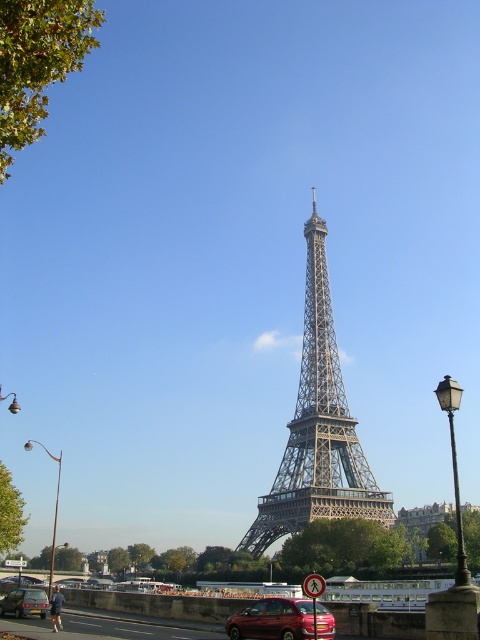
Who is lower down, metallic structure at center or metallic silver car at lower left?

metallic silver car at lower left

Is point (267, 500) less distant than point (17, 609)?

That is True.

You are a GUI agent. You are given a task and a screenshot of the screen. Output one action in this format:
    pyautogui.click(x=<x>, y=<y>)
    Task: Click on the metallic structure at center
    Image resolution: width=480 pixels, height=640 pixels.
    Given the screenshot: What is the action you would take?
    pyautogui.click(x=317, y=428)

Looking at this image, does metallic red car at center come behind metallic silver car at lower left?

No, it is not.

Between point (275, 605) and point (15, 604), which one is positioned in front?

Point (275, 605) is more forward.

Does point (228, 636) come behind point (27, 595)?

No, it is in front of (27, 595).

Find the location of a particular element. Image resolution: width=480 pixels, height=640 pixels. metallic red car at center is located at coordinates (280, 620).

Is metallic structure at center bigger than metallic red car at center?

Yes, metallic structure at center is bigger than metallic red car at center.

This screenshot has height=640, width=480. I want to click on metallic structure at center, so click(x=317, y=428).

The image size is (480, 640). What are the coordinates of `metallic structure at center` in the screenshot? It's located at (317, 428).

This screenshot has height=640, width=480. Find the location of `metallic structure at center`. metallic structure at center is located at coordinates (317, 428).